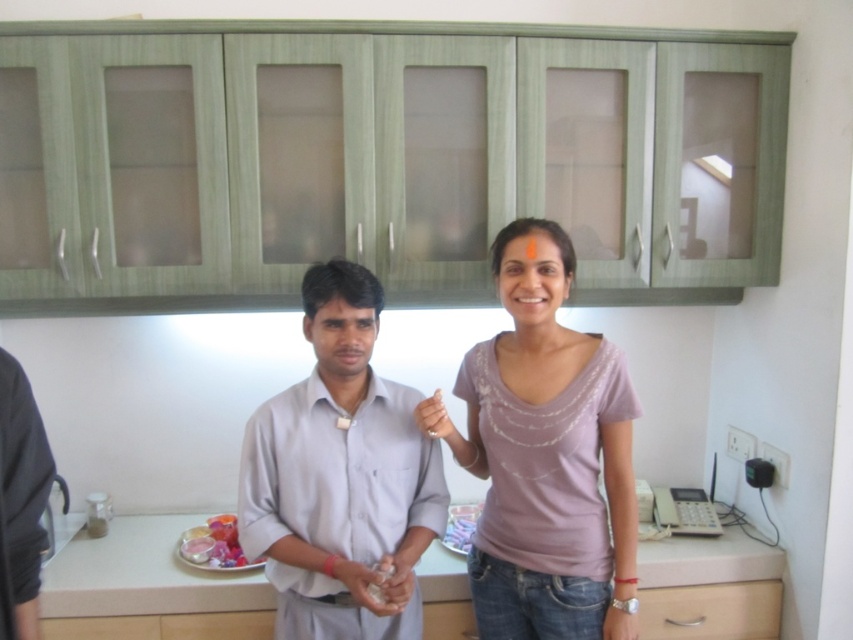
You are a delivery robot that is 16 inches wide. You need to move from the entrance to the glossy plastic containers at lower center. There is a light gray cotton shirt at center in your path. Can you pass between them without hitting anything?

The distance between the light gray cotton shirt at center and the glossy plastic containers at lower center is 18.01 inches. Since the robot is 16 inches wide, there is enough space for it to pass through without hitting either object.

You are a photographer setting up a shoot in a kitchen. You need to ensure that the light gray cotton shirt at center and the white matte hand at center are both visible in the frame. Based on their positions, which object should you focus on first to ensure both are in focus?

The light gray cotton shirt at center has a greater height compared to the white matte hand at center. Therefore, you should focus on the light gray cotton shirt at center first to ensure both are in focus.